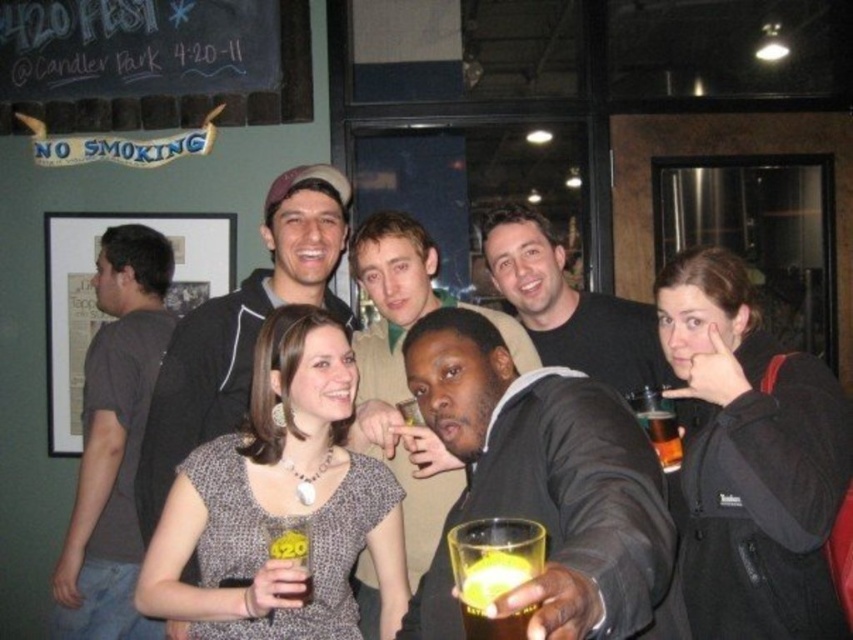
Looking at this image, you are standing in the room and want to touch both the smooth black suit at center and the smooth black jacket at center. Which one can you reach first without moving your position?

The smooth black suit at center is closer to the viewer than the smooth black jacket at center, so you can reach it first without moving your position.